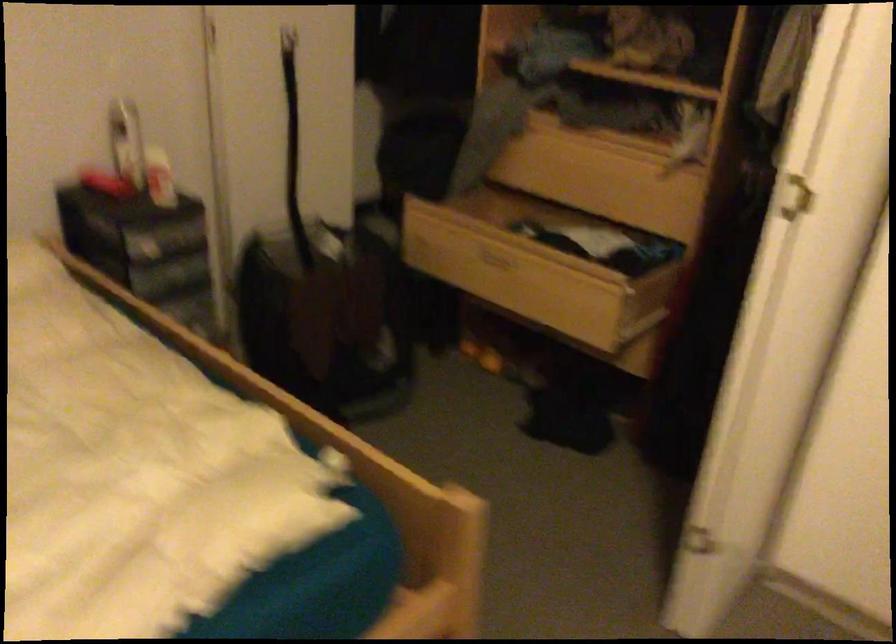
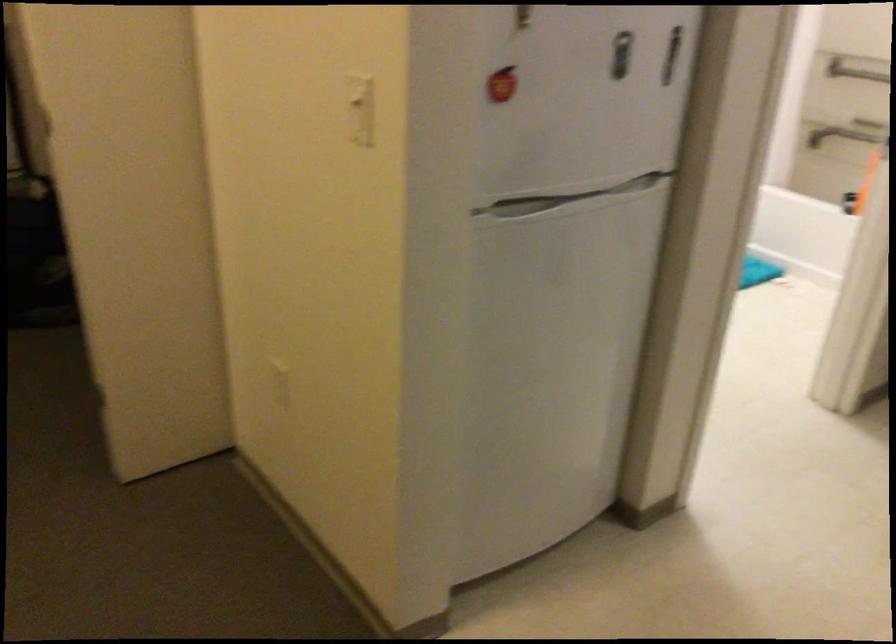
Question: I am providing you with two images of the same scene from different viewpoints. Please identify which objects are invisible in image2.

Choices:
 (A) refrigerator handle
 (B) red apple magnet
 (C) white door handle
 (D) silver dispenser pump

Answer: (C)